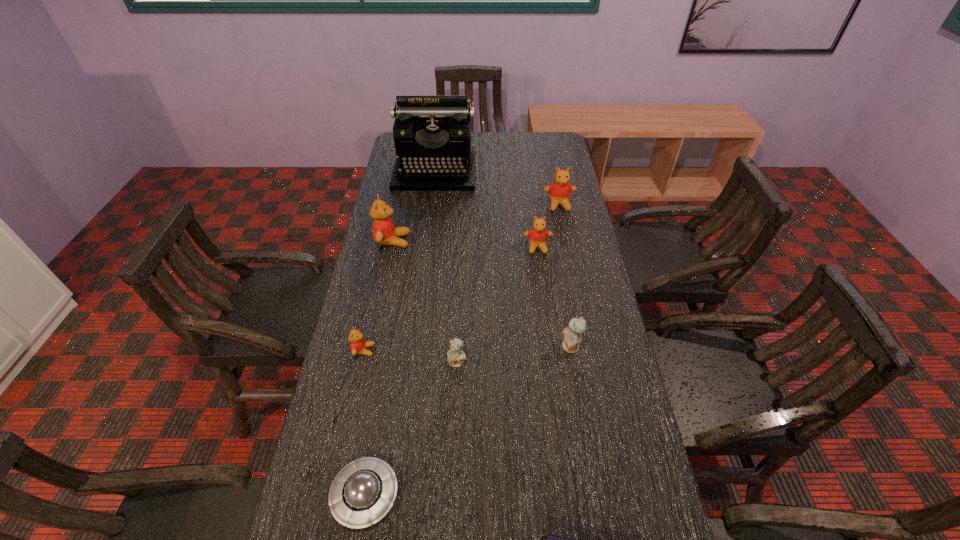
Find the location of a particular element. The width and height of the screenshot is (960, 540). the smallest red teddy bear is located at coordinates (358, 346).

Locate an element on the screen. the second shortest object is located at coordinates (362, 493).

Identify the location of gray saucer. [x=362, y=493].

The width and height of the screenshot is (960, 540). I want to click on vacant space positioned on the typing side of the black typewriter, so click(x=430, y=208).

Locate an element on the screen. This screenshot has height=540, width=960. free space located on the front-facing side of the biggest red teddy bear is located at coordinates (432, 241).

What are the coordinates of `free space located 0.250m on the front-facing side of the fifth shortest teddy bear` in the screenshot? It's located at (570, 259).

Image resolution: width=960 pixels, height=540 pixels. What are the coordinates of `free region located 0.330m on the front-facing side of the right blue teddy bear` in the screenshot? It's located at (443, 347).

Locate an element on the screen. The image size is (960, 540). free space located on the front-facing side of the right blue teddy bear is located at coordinates (525, 347).

This screenshot has height=540, width=960. Identify the location of blank space located on the front-facing side of the right blue teddy bear. (490, 347).

Locate an element on the screen. vacant region located on the front-facing side of the third biggest red teddy bear is located at coordinates (541, 281).